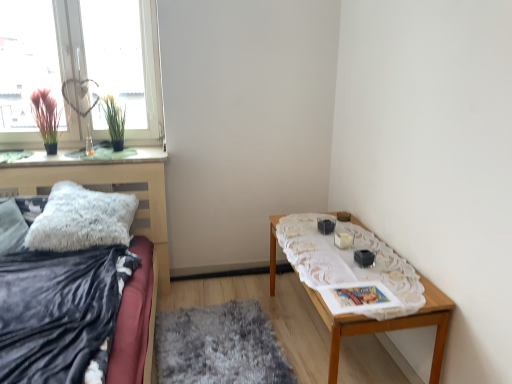
Question: Considering the positions of wooden table at right and green grass-like plant at upper left, positioned as the 1th plant in right-to-left order, in the image, is wooden table at right bigger or smaller than green grass-like plant at upper left, positioned as the 1th plant in right-to-left order,?

Choices:
 (A) small
 (B) big

Answer: (B)

Question: Considering the positions of point 445,306 and point 113,104, is point 445,306 closer or farther from the camera than point 113,104?

Choices:
 (A) closer
 (B) farther

Answer: (A)

Question: Considering the real-world distances, which object is closest to the white fluffy pillow at left?

Choices:
 (A) green grass-like plant at upper left, the 2th plant when ordered from left to right
 (B) velvet dark blue blanket at lower left, the first blanket viewed from the left
 (C) transparent glass window at upper left
 (D) wooden table at right
 (E) white lace tablecloth at right, the 1th blanket positioned from the right

Answer: (B)

Question: Estimate the real-world distances between objects in this image. Which object is closer to the green grass-like plant at upper left, the 2th plant when ordered from left to right?

Choices:
 (A) wooden table at right
 (B) silky pink plant at window, arranged as the first plant when viewed from the left
 (C) velvet dark blue blanket at lower left, the first blanket viewed from the left
 (D) white lace tablecloth at right, the 1th blanket positioned from the right
 (E) transparent glass window at upper left

Answer: (E)